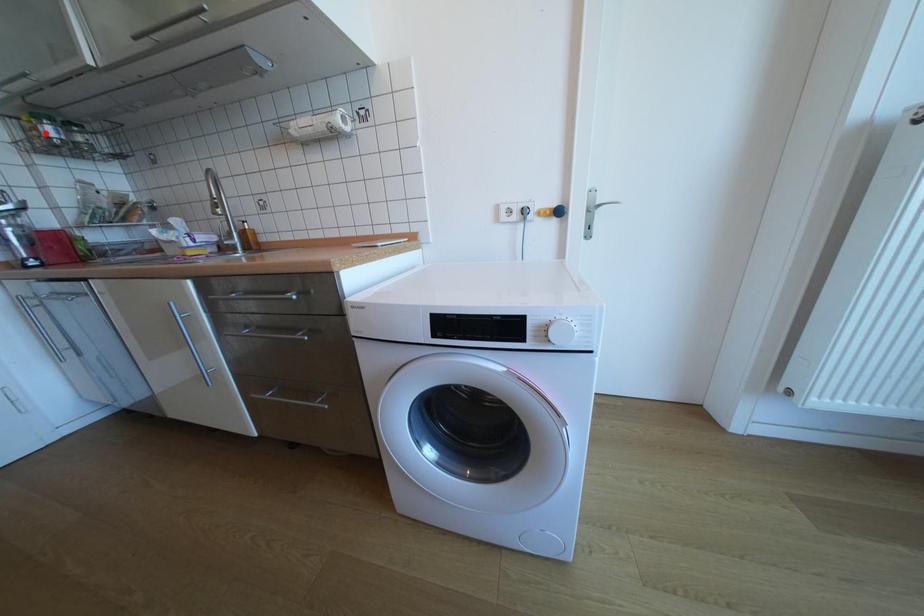
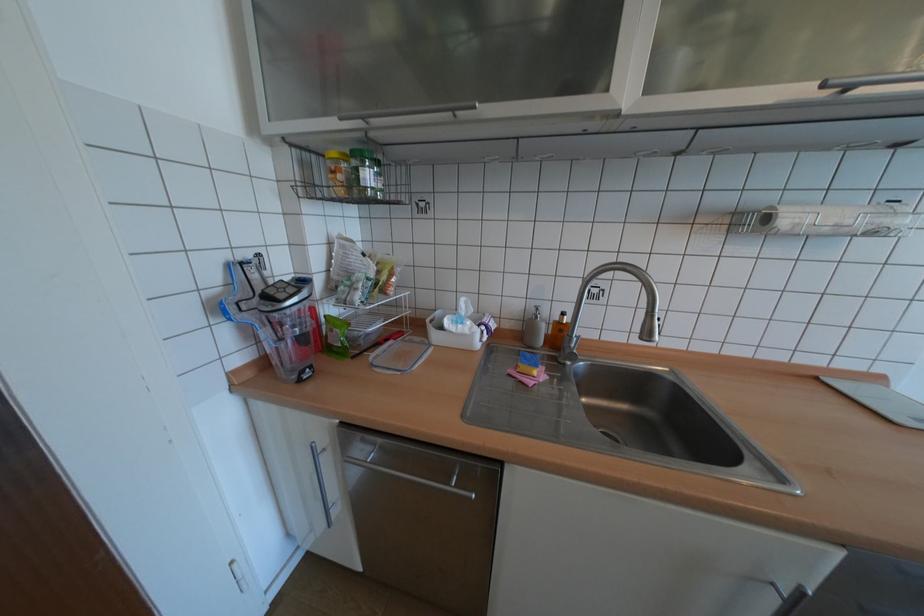
Locate, in the second image, the point that corresponds to the highlighted location in the first image.

(348, 177)